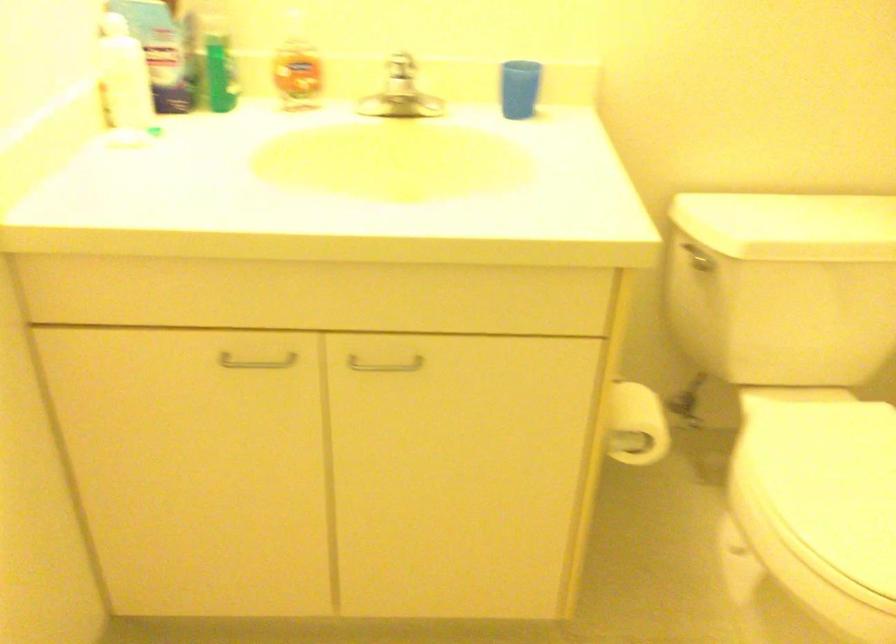
Describe the element at coordinates (401, 66) in the screenshot. I see `a faucet handle` at that location.